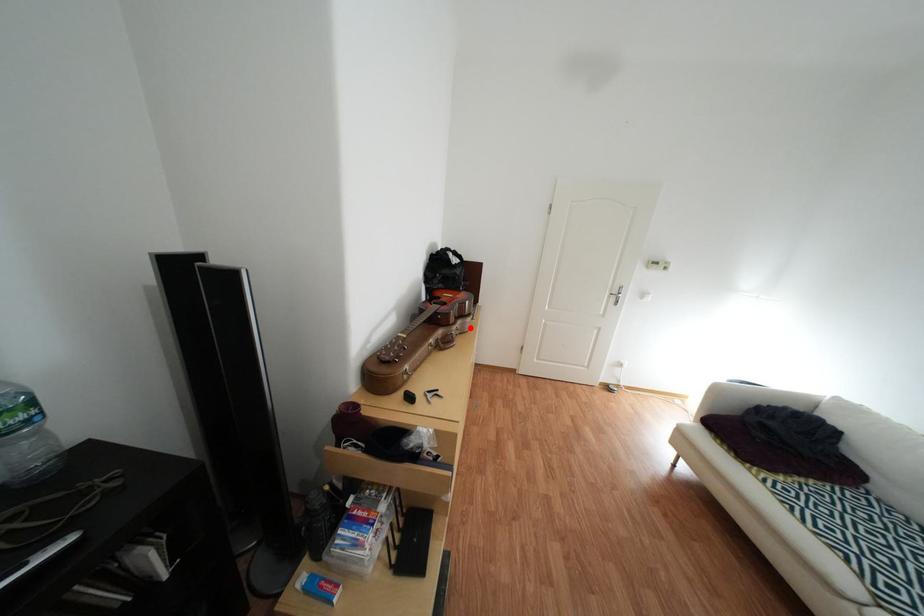
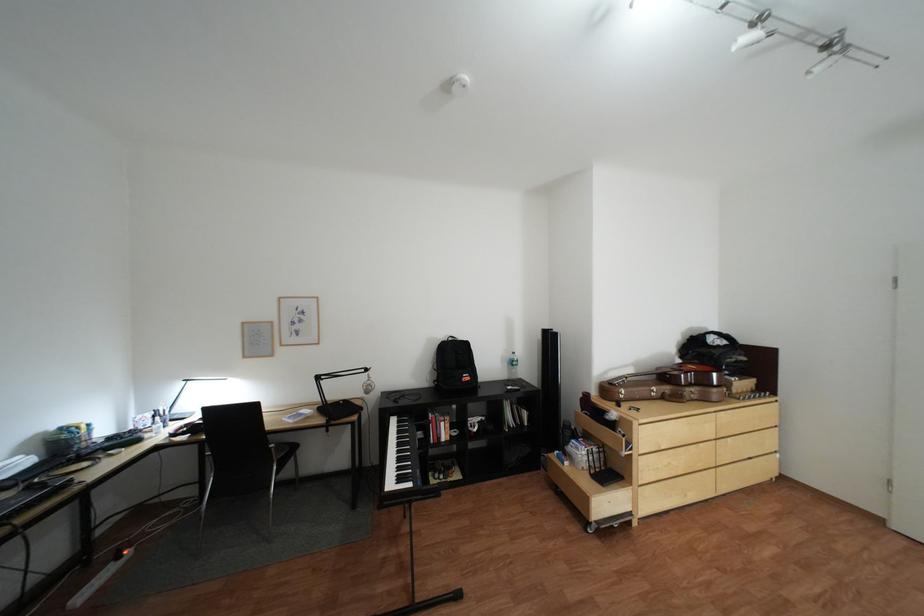
Question: I am providing you with two images of the same scene from different viewpoints. A red point is marked on the first image. Is the red point's position out of view in image 2?

Choices:
 (A) Yes
 (B) No

Answer: (B)